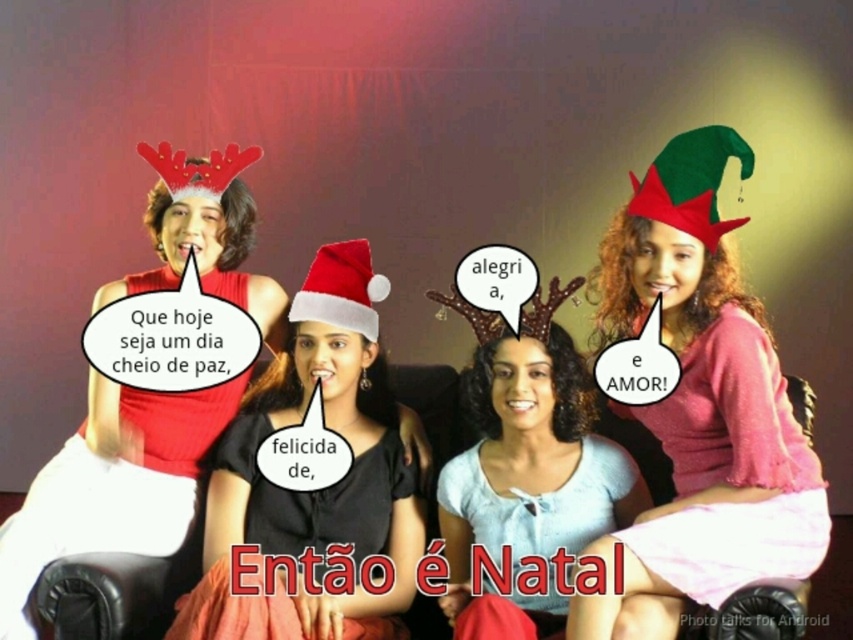
Does matte red dress at center have a lesser width compared to matte red dress at left?

Yes.

Does matte red dress at center lie behind matte red dress at left?

No, it is in front of matte red dress at left.

In order to click on matte red dress at center in this screenshot , I will do `click(318, 490)`.

The width and height of the screenshot is (853, 640). I want to click on matte red dress at center, so click(x=318, y=490).

Is matte red dress at left smaller than white matte shirt at center?

No, matte red dress at left is not smaller than white matte shirt at center.

Can you confirm if matte red dress at left is shorter than white matte shirt at center?

In fact, matte red dress at left may be taller than white matte shirt at center.

Which is behind, point (225, 422) or point (514, 467)?

Positioned behind is point (225, 422).

Where is `matte red dress at left`? matte red dress at left is located at coordinates (112, 484).

Can you confirm if matte red dress at left is positioned to the left of green felt christmas hat at upper right?

Yes, matte red dress at left is to the left of green felt christmas hat at upper right.

Does matte red dress at left have a lesser width compared to green felt christmas hat at upper right?

Incorrect, matte red dress at left's width is not less than green felt christmas hat at upper right's.

This screenshot has height=640, width=853. I want to click on matte red dress at left, so point(112,484).